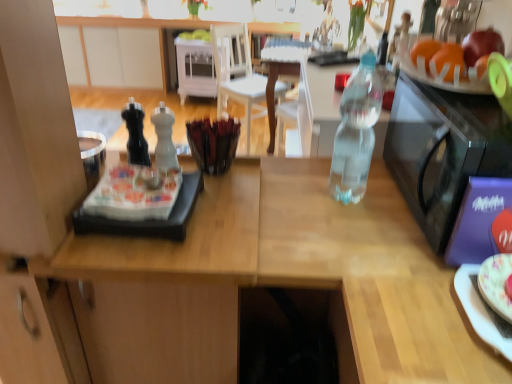
The image size is (512, 384). What are the coordinates of `vacant space that's between black glass pepper shaker at left, which is counted as the third bottle, starting from the right, and porcelain floral plate at right` in the screenshot? It's located at [x=334, y=242].